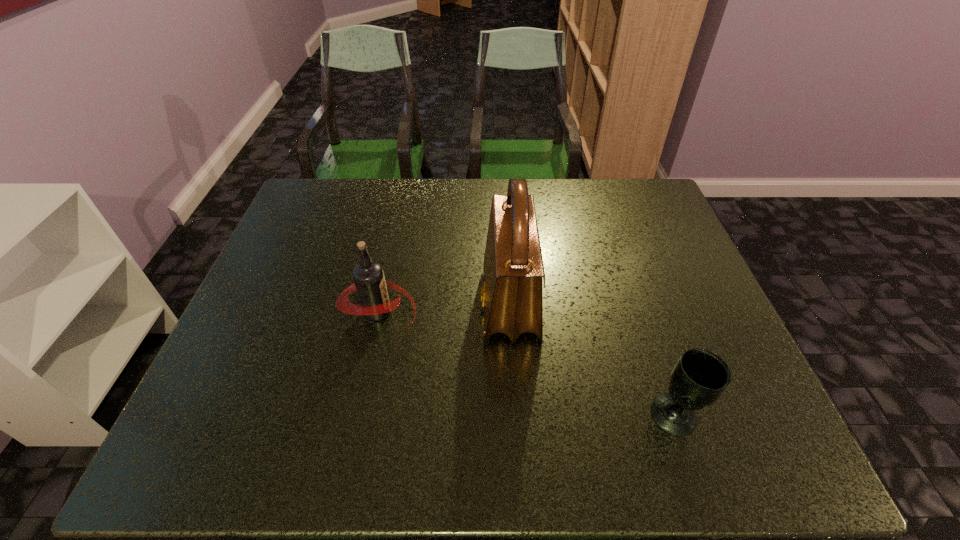
At what (x,y) coordinates should I click in order to perform the action: click on vacant space that satisfies the following two spatial constraints: 1. on the front flap of the shoulder bag; 2. on the right side of the shortest object. Please return your answer as a coordinate pair (x, y). This screenshot has width=960, height=540. Looking at the image, I should click on click(516, 414).

Where is `free location that satisfies the following two spatial constraints: 1. on the label of the root beer; 2. on the left side of the shortest object`? The height and width of the screenshot is (540, 960). free location that satisfies the following two spatial constraints: 1. on the label of the root beer; 2. on the left side of the shortest object is located at coordinates (356, 414).

Where is `blank space that satisfies the following two spatial constraints: 1. on the front flap of the tallest object; 2. on the right side of the chalice`? This screenshot has height=540, width=960. blank space that satisfies the following two spatial constraints: 1. on the front flap of the tallest object; 2. on the right side of the chalice is located at coordinates point(516,414).

You are a GUI agent. You are given a task and a screenshot of the screen. Output one action in this format:
    pyautogui.click(x=<x>, y=<y>)
    Task: Click on the free space in the image that satisfies the following two spatial constraints: 1. on the front flap of the tallest object; 2. on the back side of the chalice
    The image size is (960, 540).
    Given the screenshot: What is the action you would take?
    pyautogui.click(x=516, y=414)

Find the location of a particular element. The image size is (960, 540). free region that satisfies the following two spatial constraints: 1. on the label of the shortest object; 2. on the right side of the leftmost object is located at coordinates (356, 414).

Find the location of a particular element. Image resolution: width=960 pixels, height=540 pixels. vacant area in the image that satisfies the following two spatial constraints: 1. on the back side of the rightmost object; 2. on the front flap of the shoulder bag is located at coordinates (638, 305).

This screenshot has height=540, width=960. I want to click on blank area in the image that satisfies the following two spatial constraints: 1. on the label of the nearest object; 2. on the left side of the root beer, so click(x=356, y=414).

The image size is (960, 540). What are the coordinates of `free location that satisfies the following two spatial constraints: 1. on the front flap of the nearest object; 2. on the left side of the shoulder bag` in the screenshot? It's located at (516, 414).

Locate an element on the screen. free space that satisfies the following two spatial constraints: 1. on the back side of the shortest object; 2. on the label of the leftmost object is located at coordinates (640, 311).

Locate an element on the screen. This screenshot has width=960, height=540. vacant position in the image that satisfies the following two spatial constraints: 1. on the front flap of the tallest object; 2. on the left side of the shortest object is located at coordinates (516, 414).